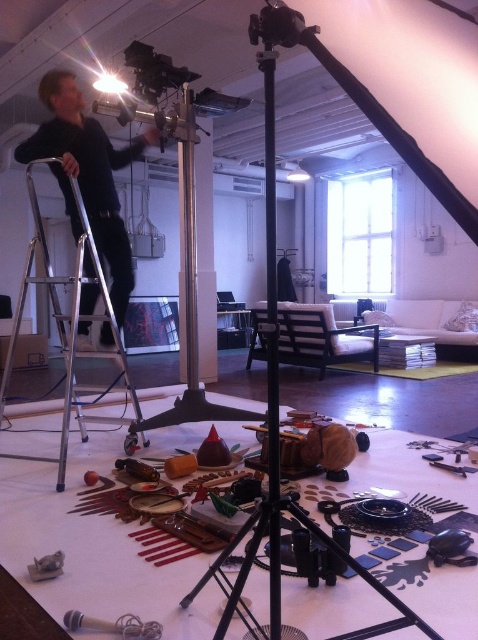
Between point (69, 84) and point (116, 333), which one is positioned in front?

Point (116, 333) is in front.

Between point (140, 148) and point (73, 305), which one is positioned behind?

Point (140, 148)

Is point (107, 145) positioned behind point (43, 241)?

Yes, it is behind point (43, 241).

Find the location of a particular element. black fabric man at left is located at coordinates (86, 176).